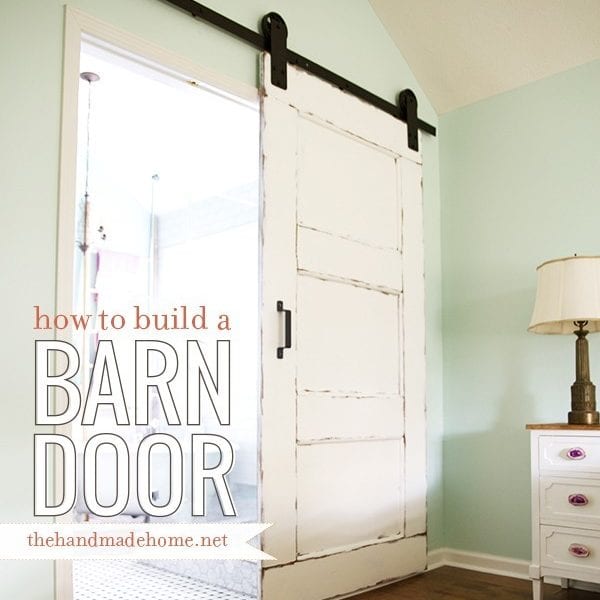
This screenshot has width=600, height=600. I want to click on wall, so click(x=524, y=208).